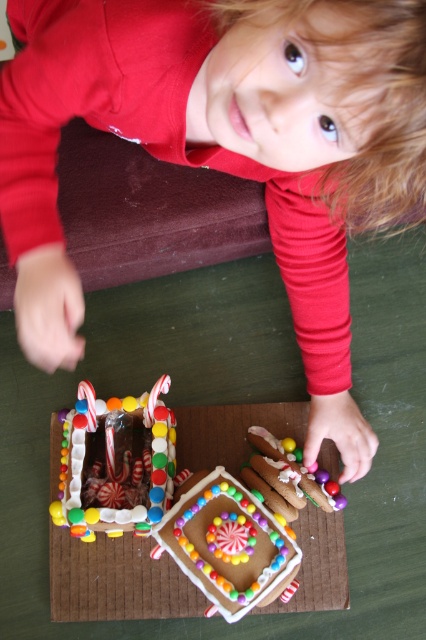
Question: Can you confirm if glossy chocolate cake at center is positioned to the left of glossy icing gingerbread house at center?

Choices:
 (A) no
 (B) yes

Answer: (B)

Question: Which object appears closest to the camera in this image?

Choices:
 (A) glossy icing gingerbread house at center
 (B) glossy chocolate cake at center

Answer: (A)

Question: Is glossy chocolate cake at center thinner than glossy icing gingerbread house at center?

Choices:
 (A) yes
 (B) no

Answer: (A)

Question: Is glossy chocolate cake at center wider than glossy icing gingerbread house at center?

Choices:
 (A) no
 (B) yes

Answer: (A)

Question: Which object is farther from the camera taking this photo?

Choices:
 (A) glossy icing gingerbread house at center
 (B) glossy chocolate cake at center

Answer: (B)